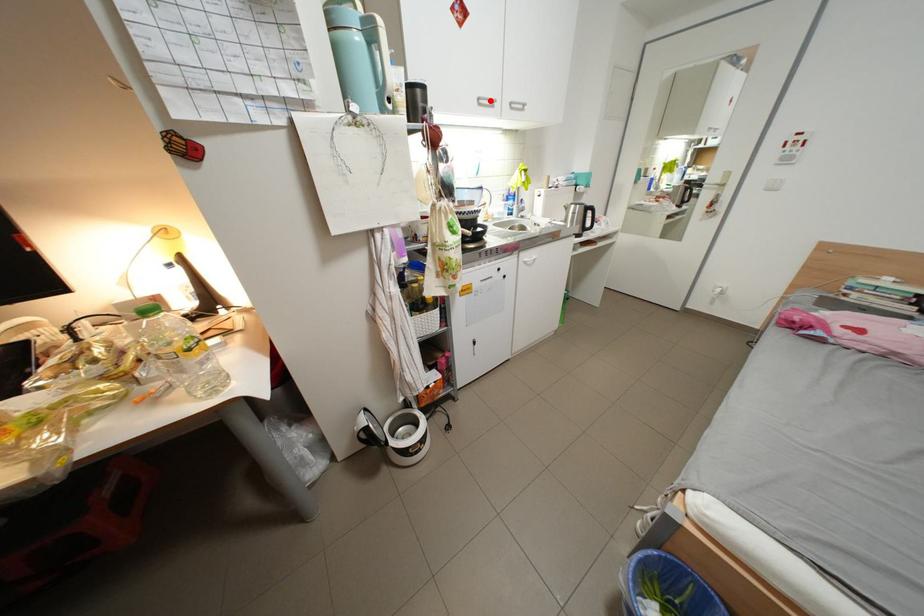
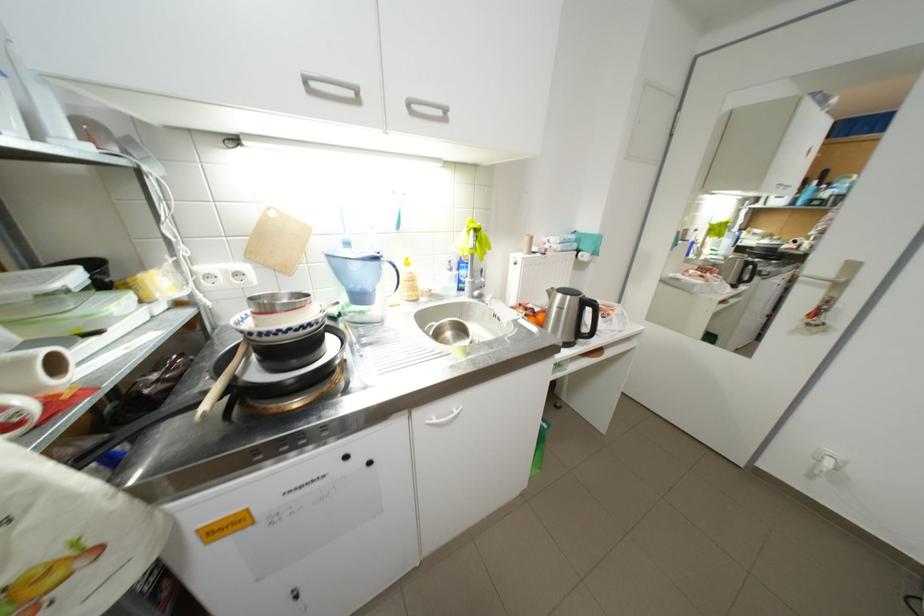
Where in the second image is the point corresponding to the highlighted location from the first image?

(317, 79)